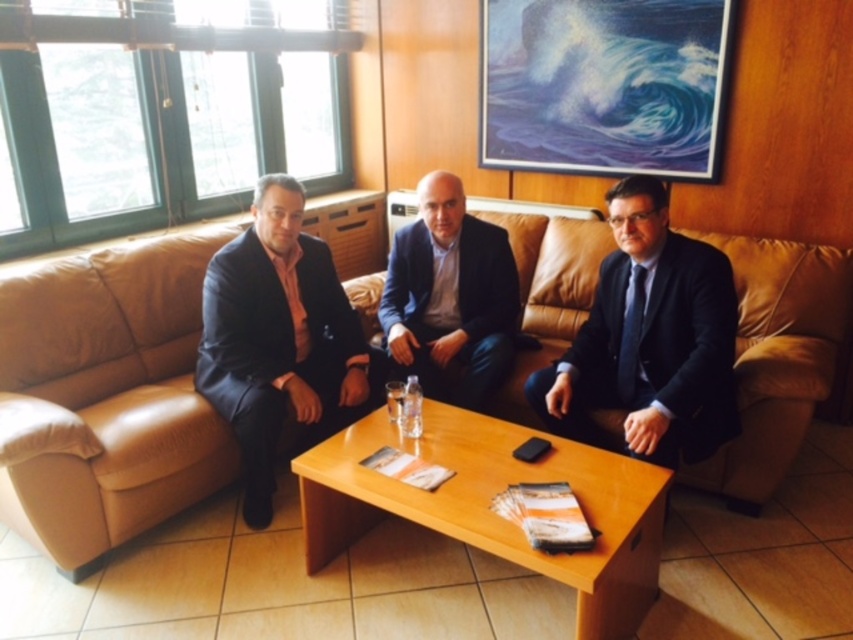
Measure the distance between leather couch at center and black leather suit at center.

leather couch at center is 5.05 feet away from black leather suit at center.

Does point (62, 468) lie in front of point (677, 317)?

Yes.

Locate an element on the screen. The width and height of the screenshot is (853, 640). leather couch at center is located at coordinates (106, 396).

At what (x,y) coordinates should I click in order to perform the action: click on leather couch at center. Please return your answer as a coordinate pair (x, y). Looking at the image, I should click on (106, 396).

Which of these two, black leather suit at center or matte black suit at left, stands taller?

Standing taller between the two is matte black suit at left.

Is point (573, 378) positioned in front of point (286, 264)?

That is True.

Locate an element on the screen. black leather suit at center is located at coordinates (650, 339).

Who is more distant from viewer, [711,410] or [395,353]?

The point [395,353] is behind.

Based on the photo, does black leather suit at center appear on the left side of dark blue suit at center?

Incorrect, black leather suit at center is not on the left side of dark blue suit at center.

Measure the distance between point (695, 394) and camera.

The distance of point (695, 394) from camera is 7.35 feet.

Where is `black leather suit at center`? black leather suit at center is located at coordinates (650, 339).